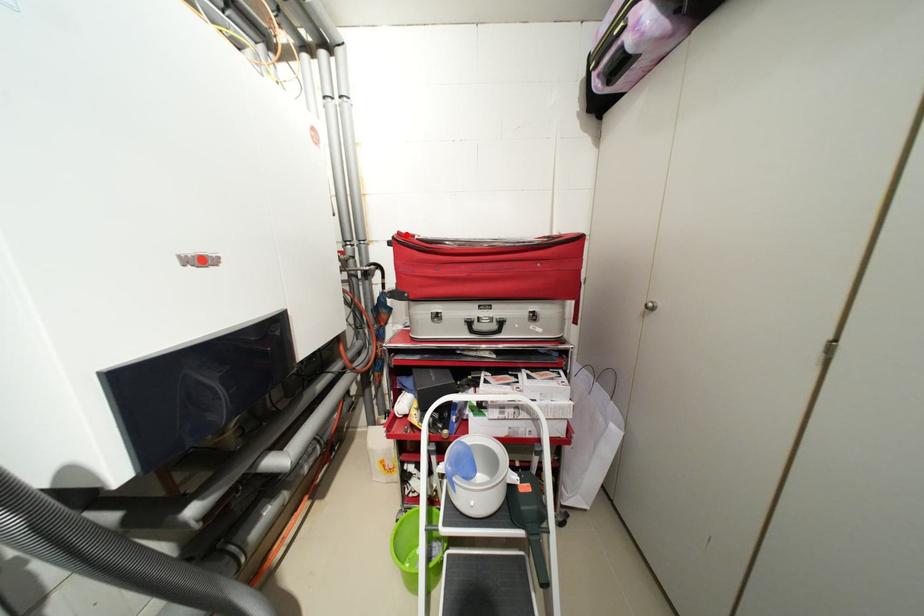
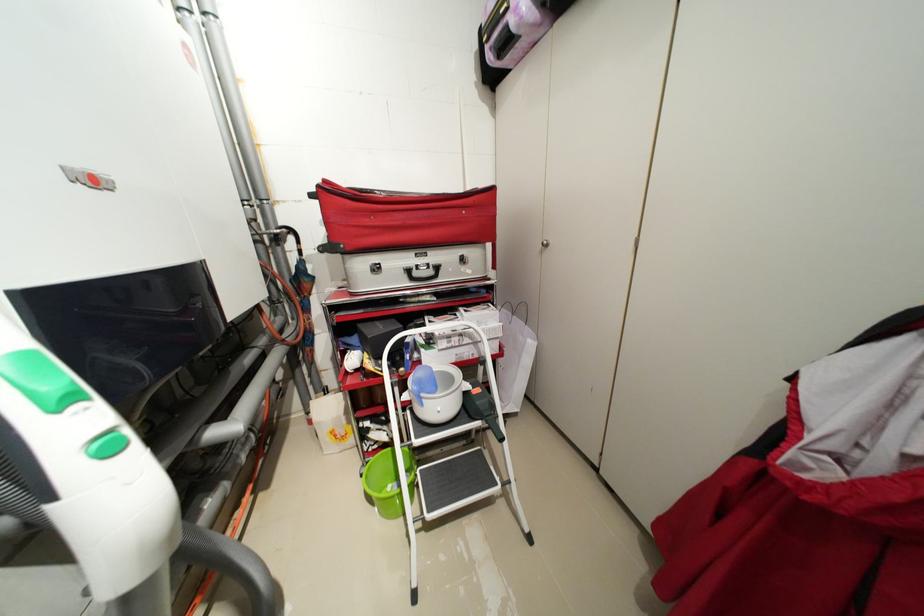
Where in the second image is the point corresponding to the highlighted location from the first image?

(332, 182)